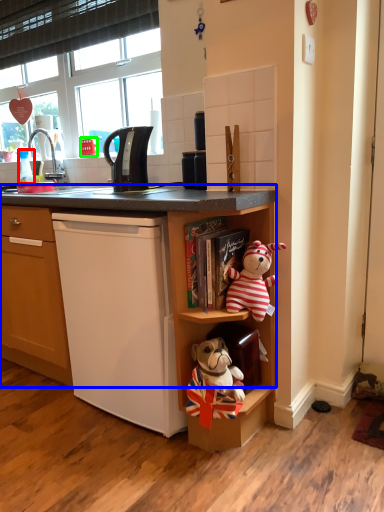
Question: Considering the real-world distances, which object is farthest from coffee cup (highlighted by a red box)? cabinet (highlighted by a blue box) or corded phone (highlighted by a green box)?

Choices:
 (A) cabinet
 (B) corded phone

Answer: (A)